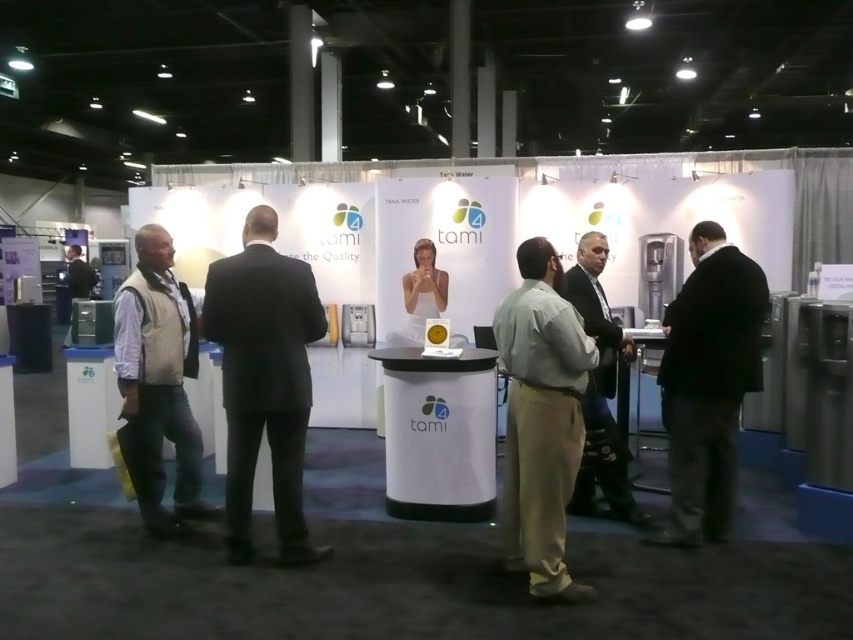
Question: Is light brown cotton pants at center wider than black wool suit at right?

Choices:
 (A) yes
 (B) no

Answer: (B)

Question: From the image, what is the correct spatial relationship of black suit at center in relation to dark gray suit at center?

Choices:
 (A) left
 (B) right

Answer: (A)

Question: Estimate the real-world distances between objects in this image. Which object is farther from the light brown cotton pants at center?

Choices:
 (A) black suit at center
 (B) light brown vest at left
 (C) black wool suit at right
 (D) dark gray suit at center

Answer: (B)

Question: Is black suit at center to the left of light brown vest at left from the viewer's perspective?

Choices:
 (A) yes
 (B) no

Answer: (B)

Question: Which of the following is the closest to the observer?

Choices:
 (A) light brown cotton pants at center
 (B) light brown vest at left
 (C) dark gray suit at center

Answer: (A)

Question: Estimate the real-world distances between objects in this image. Which object is closer to the black suit at center?

Choices:
 (A) light brown vest at left
 (B) light brown cotton pants at center
 (C) dark gray suit at center
 (D) black wool suit at right

Answer: (A)